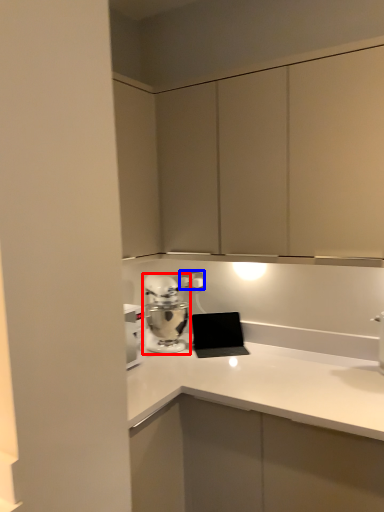
Question: Which of the following is the farthest to the observer, home appliance (highlighted by a red box) or electric outlet (highlighted by a blue box)?

Choices:
 (A) home appliance
 (B) electric outlet

Answer: (B)